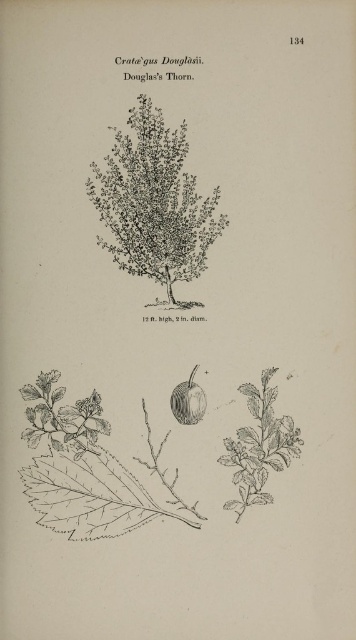
Is point (124, 237) positioned in front of point (200, 394)?

No, (124, 237) is behind (200, 394).

Which is more to the left, grayish-green textured bush at center or smooth green apple at center?

grayish-green textured bush at center is more to the left.

Where is `grayish-green textured bush at center`? This screenshot has width=356, height=640. grayish-green textured bush at center is located at coordinates (154, 202).